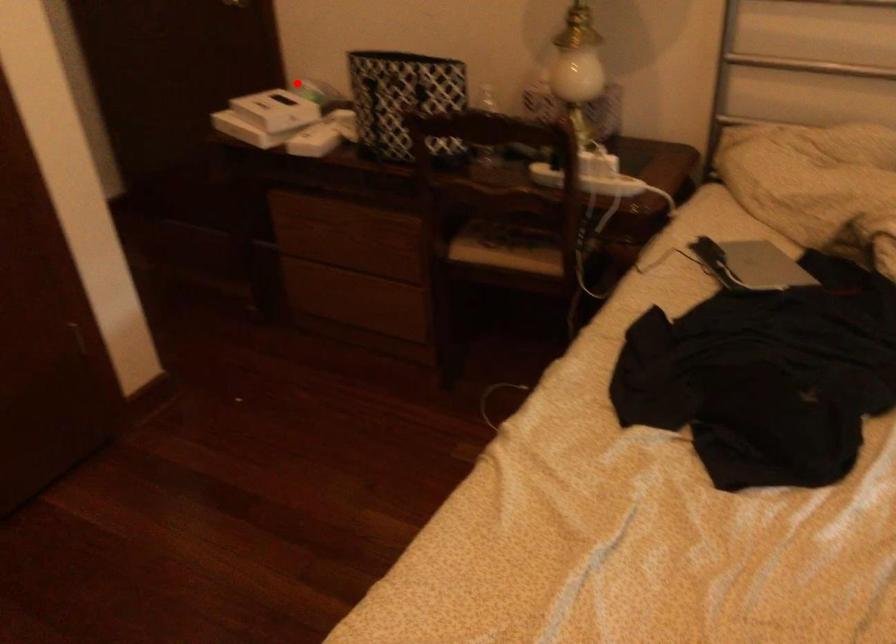
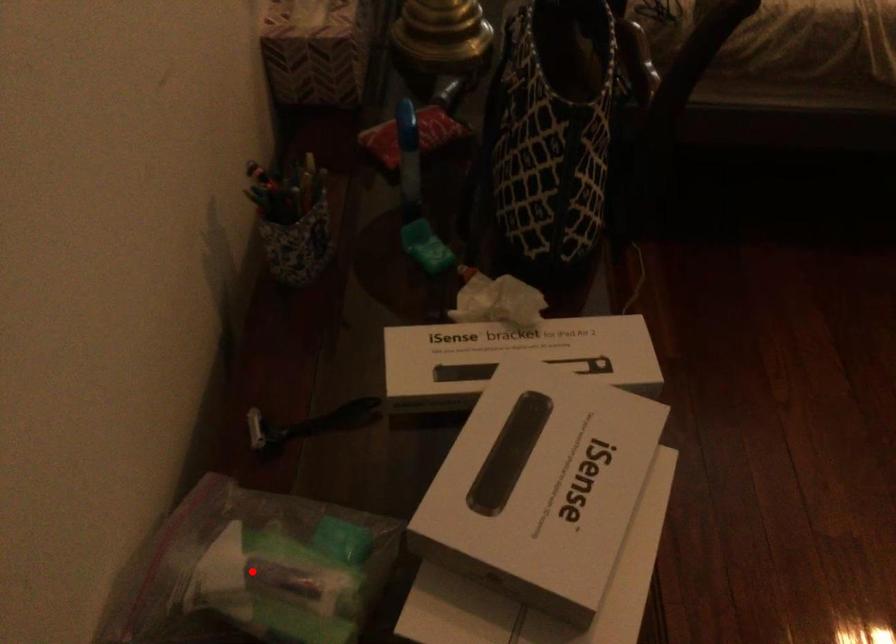
I am providing you with two images of the same scene from different viewpoints. A red point is marked on the first image and another point is marked on the second image. Do the highlighted points in image1 and image2 indicate the same real-world spot?

Yes